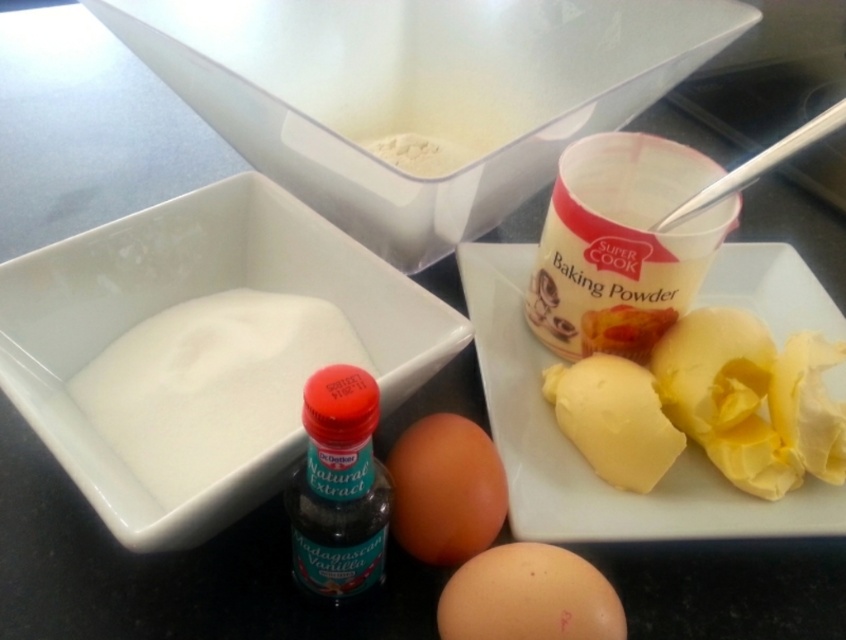
From the picture: You are a baker preparing a cake. You need to measure the white powder at left and the black glass bottle at center. Which one should you reach for first if you want to get the items in order from left to right?

The white powder at left should be reached for first since it is positioned to the left of the black glass bottle at center.

Based on the photo, you are a baker preparing a cake and need to check the height of the white powder at left and the orange matte egg at center. Which one is taller?

The white powder at left is taller than the orange matte egg at center.